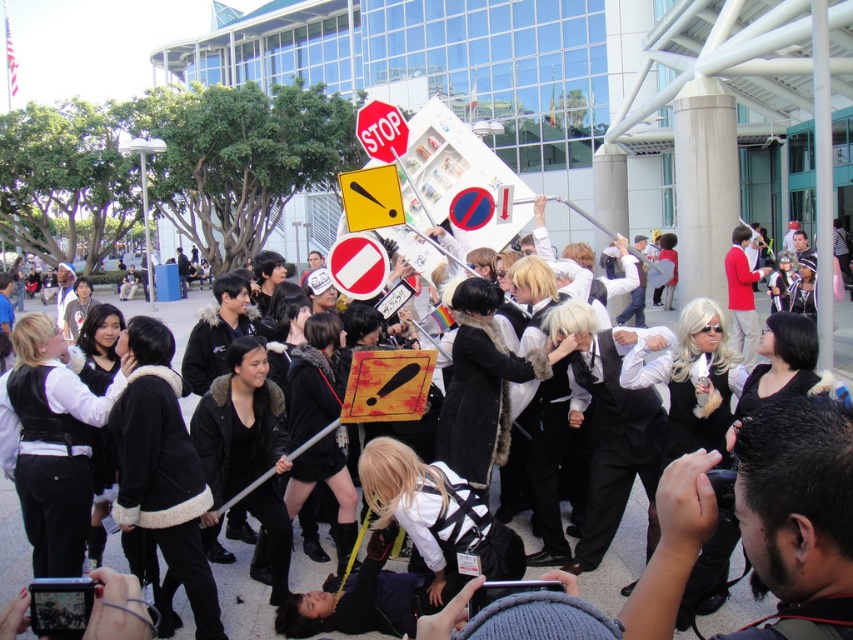
What are the coordinates of `white fur-trimmed jacket at center` in the screenshot? It's located at (619, 557).

Measure the distance between point (160,570) and camera.

A distance of 27.05 feet exists between point (160,570) and camera.

Between point (561, 516) and point (369, 275), which one is positioned in front?

Point (561, 516) is more forward.

Identify the location of white fur-trimmed jacket at center. pos(619,557).

Measure the distance from red matte stop sign at center to red plastic stop sign at center.

A distance of 3.46 meters exists between red matte stop sign at center and red plastic stop sign at center.

In order to click on red matte stop sign at center in this screenshot , I will do `click(357, 266)`.

Between point (329, 257) and point (401, 128), which one is positioned behind?

The point (401, 128) is more distant.

The height and width of the screenshot is (640, 853). I want to click on red matte stop sign at center, so click(x=357, y=266).

Can you confirm if white fur-trimmed jacket at center is thinner than red plastic stop sign at center?

No, white fur-trimmed jacket at center is not thinner than red plastic stop sign at center.

Looking at this image, can you confirm if white fur-trimmed jacket at center is taller than red plastic stop sign at center?

Indeed, white fur-trimmed jacket at center has a greater height compared to red plastic stop sign at center.

Where is `white fur-trimmed jacket at center`? This screenshot has height=640, width=853. white fur-trimmed jacket at center is located at coordinates (619, 557).

Where is `white fur-trimmed jacket at center`? This screenshot has width=853, height=640. white fur-trimmed jacket at center is located at coordinates (619, 557).